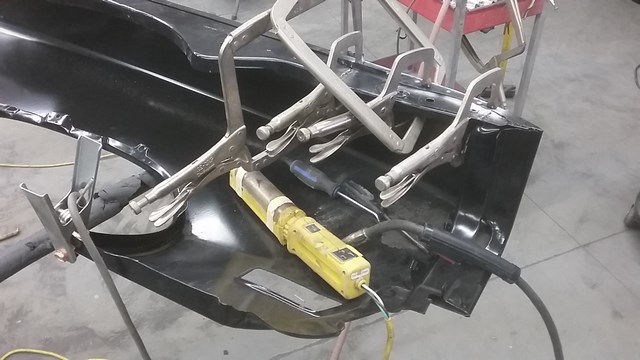
The height and width of the screenshot is (360, 640). Find the location of `tile floor`. tile floor is located at coordinates (564, 157).